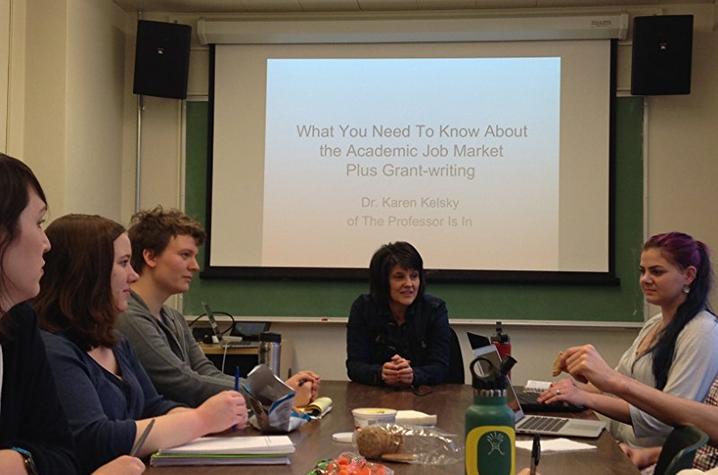
At what (x,y) coordinates should I click in order to perform the action: click on laptop. Please return your answer as a coordinate pair (x, y). This screenshot has height=475, width=718. Looking at the image, I should click on (579, 428), (250, 346).